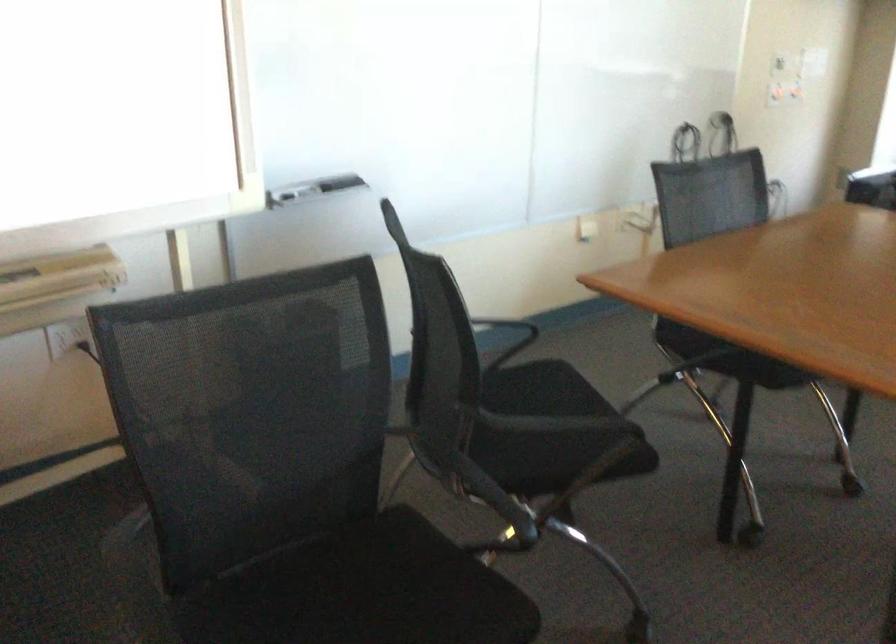
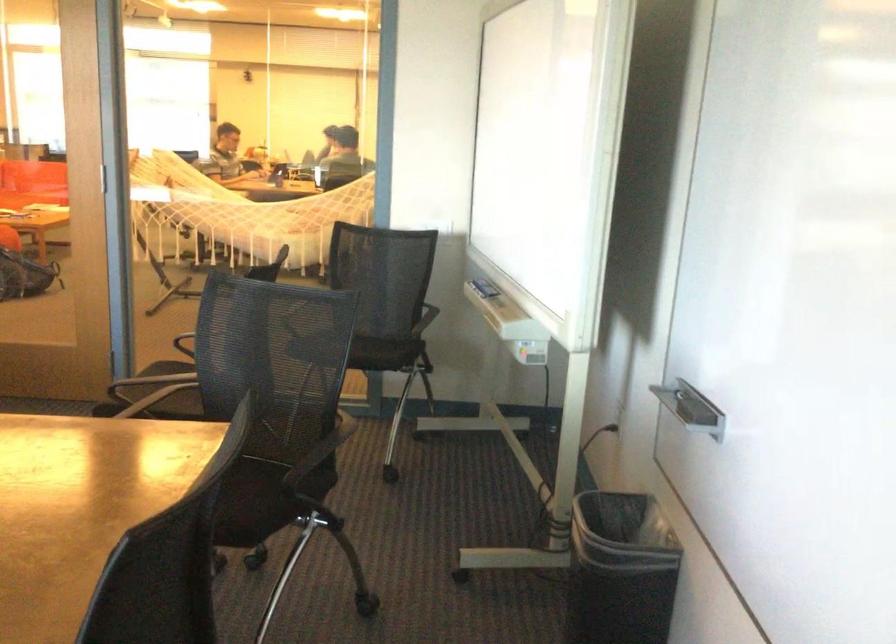
Where in the second image is the point corresponding to (364,176) from the first image?

(691, 408)